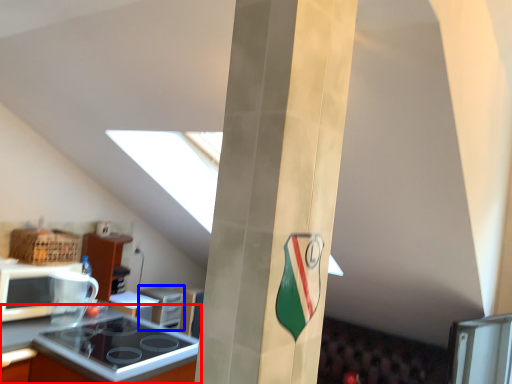
Question: Which object appears farthest to the camera in this image, countertop (highlighted by a red box) or appliance (highlighted by a blue box)?

Choices:
 (A) countertop
 (B) appliance

Answer: (B)